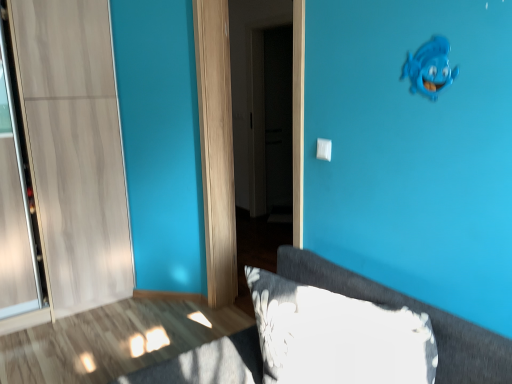
You are a GUI agent. You are given a task and a screenshot of the screen. Output one action in this format:
    pyautogui.click(x=<x>, y=<y>)
    Task: Click on the white glossy door at center
    This screenshot has width=512, height=384.
    Given the screenshot: What is the action you would take?
    pyautogui.click(x=255, y=90)

From a real-world perspective, is fluffy gray pillow at lower right under white plastic light switch at center?

Indeed, from a real-world perspective, fluffy gray pillow at lower right is positioned beneath white plastic light switch at center.

How different are the orientations of fluffy gray pillow at lower right and white plastic light switch at center in degrees?

The angle between the facing direction of fluffy gray pillow at lower right and the facing direction of white plastic light switch at center is 22.9 degrees.

Who is more distant, fluffy gray pillow at lower right or white plastic light switch at center?

white plastic light switch at center is further from the camera.

In the scene shown: From the image's perspective, would you say fluffy gray pillow at lower right is shown under white plastic light switch at center?

Yes, from the image's perspective, fluffy gray pillow at lower right is beneath white plastic light switch at center.

Would you say fluffy gray pillow at lower right is inside or outside white glossy door at center?

fluffy gray pillow at lower right is outside white glossy door at center.

How much distance is there between fluffy gray pillow at lower right and white glossy door at center?

3.17 meters.

From a real-world perspective, is fluffy gray pillow at lower right under white glossy door at center?

Yes, from a real-world perspective, fluffy gray pillow at lower right is under white glossy door at center.

Are fluffy gray pillow at lower right and white glossy door at center beside each other?

No.

Can you tell me how much fluffy gray pillow at lower right and blue matte fish at upper right differ in facing direction?

The angular difference between fluffy gray pillow at lower right and blue matte fish at upper right is 22.3 degrees.

Are fluffy gray pillow at lower right and blue matte fish at upper right located far from each other?

They are positioned close to each other.

Considering the positions of objects fluffy gray pillow at lower right and blue matte fish at upper right in the image provided, who is more to the left, fluffy gray pillow at lower right or blue matte fish at upper right?

fluffy gray pillow at lower right is more to the left.

Does fluffy gray pillow at lower right turn towards blue matte fish at upper right?

No, fluffy gray pillow at lower right is not turned towards blue matte fish at upper right.

Between white plastic light switch at center and white glossy door at center, which one has larger width?

With larger width is white glossy door at center.

Is white glossy door at center at the back of white plastic light switch at center?

That's not correct — white plastic light switch at center is not looking away from white glossy door at center.

Would you say white plastic light switch at center is a long distance from white glossy door at center?

Indeed, white plastic light switch at center is not near white glossy door at center.

From the image's perspective, which one is positioned lower, white plastic light switch at center or blue matte fish at upper right?

white plastic light switch at center is shown below in the image.

Choose the correct answer: Is white plastic light switch at center inside blue matte fish at upper right or outside it?

white plastic light switch at center is not inside blue matte fish at upper right, it's outside.

From a real-world perspective, is white plastic light switch at center physically below blue matte fish at upper right?

Yes, from a real-world perspective, white plastic light switch at center is under blue matte fish at upper right.

Can you tell me how much white plastic light switch at center and blue matte fish at upper right differ in facing direction?

The angular difference between white plastic light switch at center and blue matte fish at upper right is 0.625 degrees.

Considering the positions of points (238, 53) and (425, 78), is point (238, 53) closer to camera compared to point (425, 78)?

No, (238, 53) is further to viewer.

From the picture: Does white glossy door at center appear on the left side of blue matte fish at upper right?

Correct, you'll find white glossy door at center to the left of blue matte fish at upper right.

Considering the relative sizes of white glossy door at center and blue matte fish at upper right in the image provided, is white glossy door at center taller than blue matte fish at upper right?

Indeed, white glossy door at center has a greater height compared to blue matte fish at upper right.

Locate an element on the screen. The image size is (512, 384). screen door above the blue matte fish at upper right (from the image's perspective) is located at coordinates (255, 90).

Between white glossy door at center and white plastic light switch at center, which one has smaller width?

white plastic light switch at center is thinner.

Considering the sizes of objects white glossy door at center and white plastic light switch at center in the image provided, who is shorter, white glossy door at center or white plastic light switch at center?

white plastic light switch at center.

Identify the location of screen door on the left of white plastic light switch at center. (255, 90).

From a real-world perspective, is white glossy door at center over white plastic light switch at center?

No, from a real-world perspective, white glossy door at center is not above white plastic light switch at center.

At what (x,y) coordinates should I click in order to perform the action: click on furniture below the white plastic light switch at center (from the image's perspective). Please return your answer as a coordinate pair (x, y). Looking at the image, I should click on pyautogui.click(x=417, y=311).

This screenshot has height=384, width=512. What are the coordinates of `furniture on the right of white glossy door at center` in the screenshot? It's located at (417, 311).

Estimate the real-world distances between objects in this image. Which object is closer to blue matte fish at upper right, white plastic light switch at center or white glossy door at center?

white plastic light switch at center lies closer to blue matte fish at upper right than the other object.

Looking at the image, which one is located further to white glossy door at center, fluffy gray pillow at lower right or white plastic light switch at center?

fluffy gray pillow at lower right is positioned further to the anchor white glossy door at center.

Which object lies further to the anchor point blue matte fish at upper right, white plastic light switch at center or fluffy gray pillow at lower right?

fluffy gray pillow at lower right is further to blue matte fish at upper right.

Which object lies further to the anchor point blue matte fish at upper right, fluffy gray pillow at lower right or white glossy door at center?

Based on the image, white glossy door at center appears to be further to blue matte fish at upper right.

Looking at the image, which one is located further to white glossy door at center, blue matte fish at upper right or white plastic light switch at center?

The object further to white glossy door at center is blue matte fish at upper right.

When comparing their distances from white glossy door at center, does blue matte fish at upper right or fluffy gray pillow at lower right seem further?

blue matte fish at upper right is positioned further to the anchor white glossy door at center.

Estimate the real-world distances between objects in this image. Which object is closer to white glossy door at center, white plastic light switch at center or blue matte fish at upper right?

Based on the image, white plastic light switch at center appears to be nearer to white glossy door at center.

Estimate the real-world distances between objects in this image. Which object is further from white plastic light switch at center, fluffy gray pillow at lower right or blue matte fish at upper right?

Based on the image, fluffy gray pillow at lower right appears to be further to white plastic light switch at center.

Locate an element on the screen. The image size is (512, 384). light switch that lies between blue matte fish at upper right and fluffy gray pillow at lower right from top to bottom is located at coordinates (324, 149).

This screenshot has width=512, height=384. I want to click on animal positioned between fluffy gray pillow at lower right and white glossy door at center from near to far, so click(x=430, y=68).

This screenshot has width=512, height=384. I want to click on light switch between fluffy gray pillow at lower right and white glossy door at center from front to back, so click(324, 149).

Where is `light switch located between blue matte fish at upper right and white glossy door at center in the depth direction`? light switch located between blue matte fish at upper right and white glossy door at center in the depth direction is located at coordinates (324, 149).